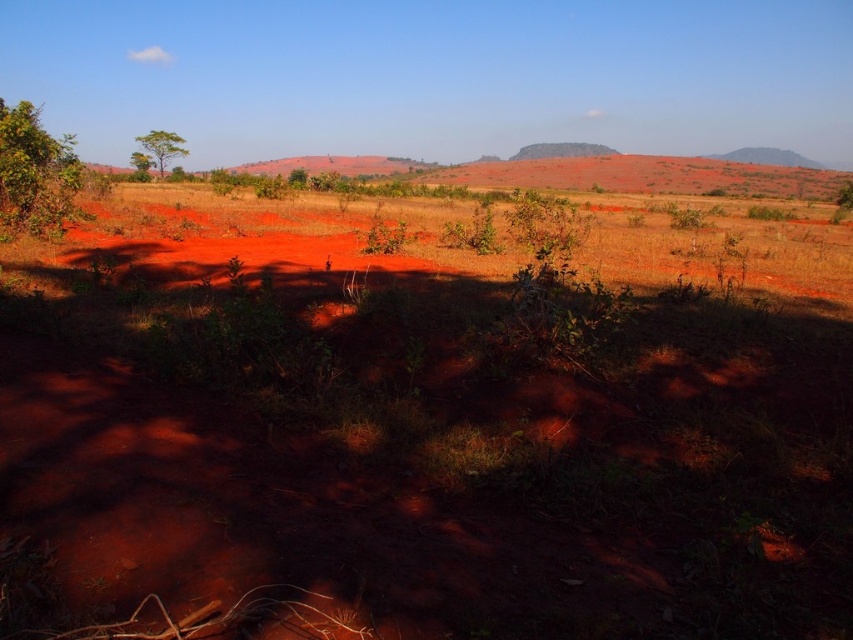
You are standing in the open landscape and want to walk towards the green leafy tree at left and the green leafy tree at upper left. Which tree will you see first as you approach them?

The green leafy tree at left will be seen first because it is positioned below the green leafy tree at upper left, meaning it is closer to the observer.